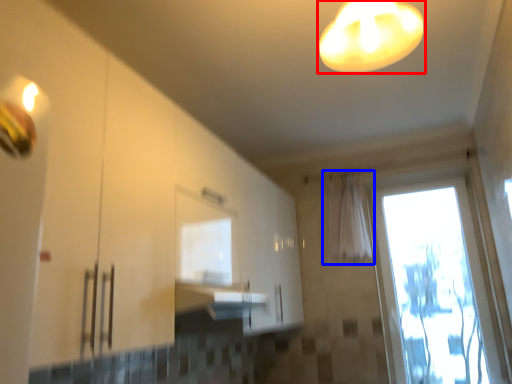
Question: Which point is further to the camera, lamp (highlighted by a red box) or curtain (highlighted by a blue box)?

Choices:
 (A) lamp
 (B) curtain

Answer: (B)